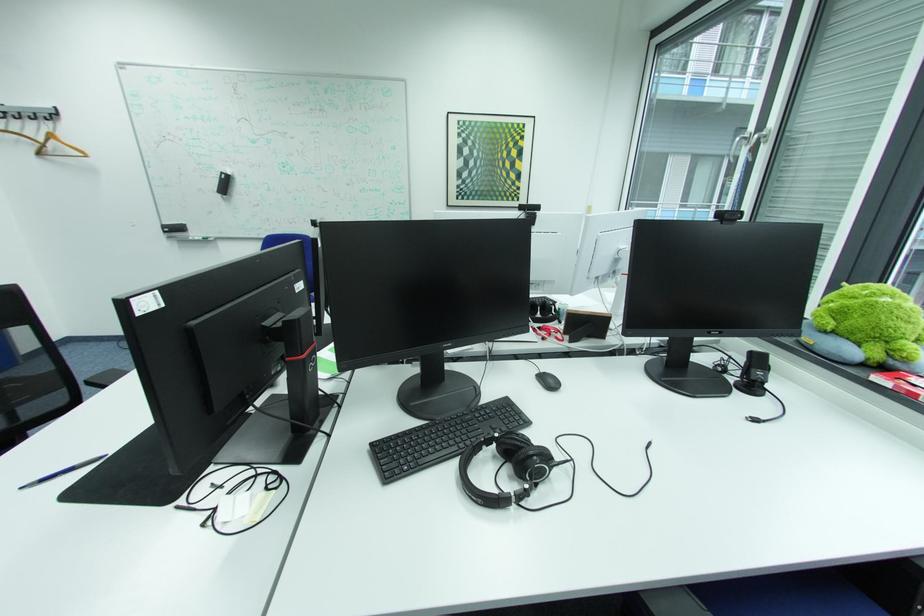
The location [63,471] corresponds to which object?

It corresponds to the blue and black pen in the image.